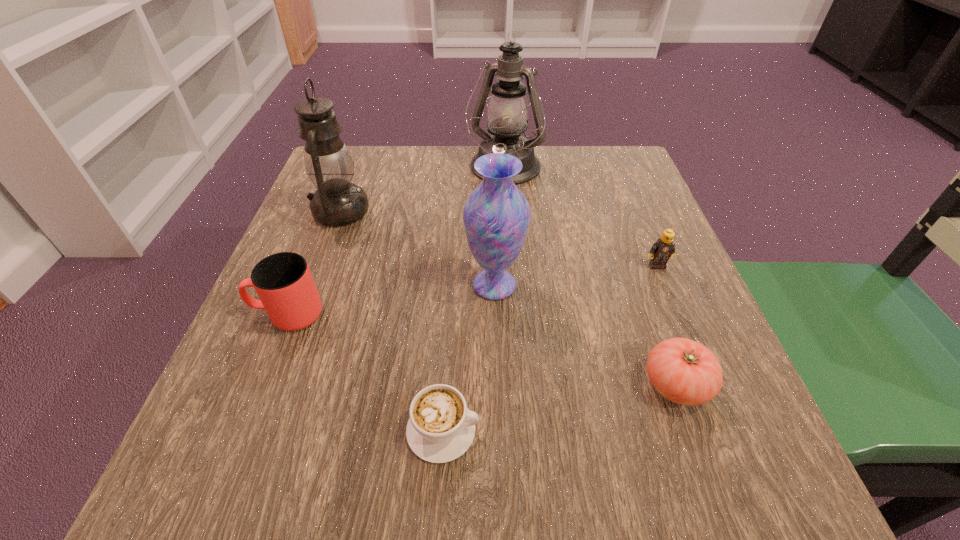
The image size is (960, 540). In order to click on the right oil lamp in this screenshot , I will do `click(508, 110)`.

The height and width of the screenshot is (540, 960). I want to click on the left oil lamp, so click(x=337, y=202).

In order to click on vase in this screenshot , I will do `click(496, 216)`.

Identify the location of the fourth tallest object. The width and height of the screenshot is (960, 540). (283, 281).

Where is `Lego`? Image resolution: width=960 pixels, height=540 pixels. Lego is located at coordinates (664, 248).

Locate an element on the screen. The width and height of the screenshot is (960, 540). tomato is located at coordinates (686, 372).

At what (x,y) coordinates should I click in order to perform the action: click on the shortest object. Please return your answer as a coordinate pair (x, y). Looking at the image, I should click on (441, 428).

Locate an element on the screen. free space located on the front of the right oil lamp is located at coordinates (508, 223).

At what (x,y) coordinates should I click in order to perform the action: click on vacant space located 0.270m on the right of the left oil lamp. Please return your answer as a coordinate pair (x, y). The image size is (960, 540). Looking at the image, I should click on (494, 211).

Image resolution: width=960 pixels, height=540 pixels. What are the coordinates of `vacant space located on the back of the vase` in the screenshot? It's located at (491, 176).